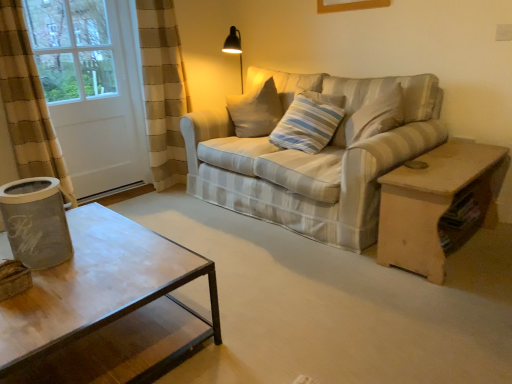
Question: Considering the relative positions of light brown wooden table at right and striped fabric pillow at center in the image provided, is light brown wooden table at right to the right of striped fabric pillow at center from the viewer's perspective?

Choices:
 (A) yes
 (B) no

Answer: (A)

Question: Does light brown wooden table at right have a lesser width compared to striped fabric pillow at center?

Choices:
 (A) yes
 (B) no

Answer: (B)

Question: From a real-world perspective, is light brown wooden table at right physically above striped fabric pillow at center?

Choices:
 (A) yes
 (B) no

Answer: (B)

Question: Is light brown wooden table at right further to the viewer compared to striped fabric pillow at center?

Choices:
 (A) no
 (B) yes

Answer: (A)

Question: From a real-world perspective, is light brown wooden table at right located beneath striped fabric pillow at center?

Choices:
 (A) no
 (B) yes

Answer: (B)

Question: Does light brown wooden table at right have a greater width compared to striped fabric pillow at center?

Choices:
 (A) yes
 (B) no

Answer: (A)

Question: Is the depth of striped fabric pillow at center greater than that of white matte screen door at left?

Choices:
 (A) yes
 (B) no

Answer: (B)

Question: From the image's perspective, is striped fabric pillow at center on top of white matte screen door at left?

Choices:
 (A) no
 (B) yes

Answer: (A)

Question: Can you confirm if striped fabric pillow at center is taller than white matte screen door at left?

Choices:
 (A) no
 (B) yes

Answer: (A)

Question: Is striped fabric pillow at center far away from white matte screen door at left?

Choices:
 (A) no
 (B) yes

Answer: (B)

Question: Is striped fabric pillow at center at the right side of white matte screen door at left?

Choices:
 (A) no
 (B) yes

Answer: (B)

Question: Can you confirm if striped fabric pillow at center is positioned to the left of white matte screen door at left?

Choices:
 (A) no
 (B) yes

Answer: (A)

Question: Considering the relative sizes of striped fabric couch at center and striped fabric pillow at center in the image provided, is striped fabric couch at center thinner than striped fabric pillow at center?

Choices:
 (A) no
 (B) yes

Answer: (A)